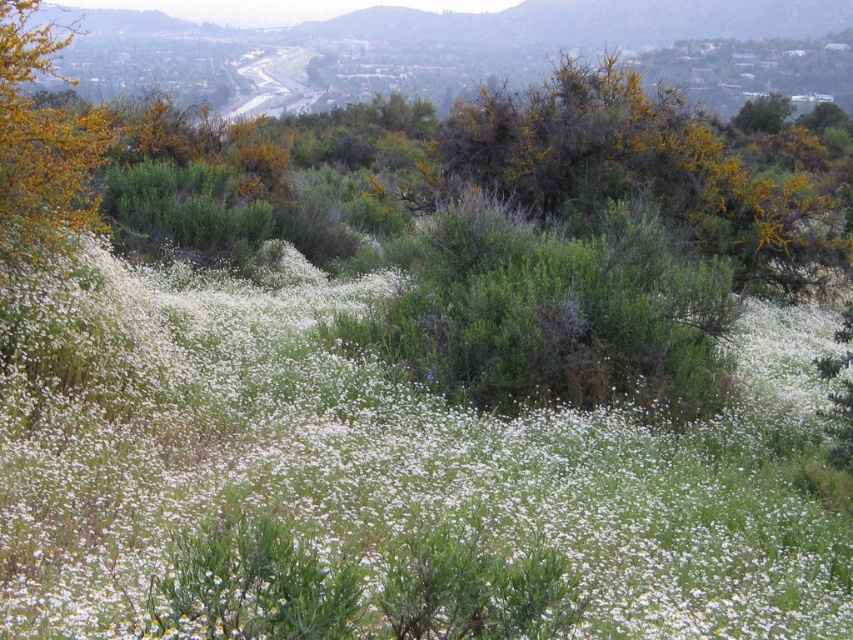
Can you confirm if white soft petals at center is taller than golden textured bush at upper left?

No.

Can you confirm if white soft petals at center is positioned above golden textured bush at upper left?

No, white soft petals at center is not above golden textured bush at upper left.

I want to click on white soft petals at center, so click(x=366, y=467).

Can you confirm if white soft petals at center is positioned below green leafy bush at upper right?

Indeed, white soft petals at center is positioned under green leafy bush at upper right.

Between white soft petals at center and green leafy bush at upper right, which one is positioned lower?

Positioned lower is white soft petals at center.

What are the coordinates of `white soft petals at center` in the screenshot? It's located at (366, 467).

Does point (30, 51) lie behind point (751, 104)?

No.

Can you confirm if golden textured bush at upper left is positioned above green leafy bush at upper right?

Incorrect, golden textured bush at upper left is not positioned above green leafy bush at upper right.

Locate an element on the screen. golden textured bush at upper left is located at coordinates (41, 145).